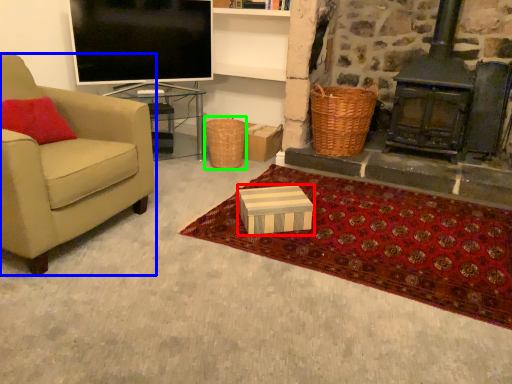
Question: Estimate the real-world distances between objects in this image. Which object is closer to box (highlighted by a red box), chair (highlighted by a blue box) or picnic basket (highlighted by a green box)?

Choices:
 (A) chair
 (B) picnic basket

Answer: (A)